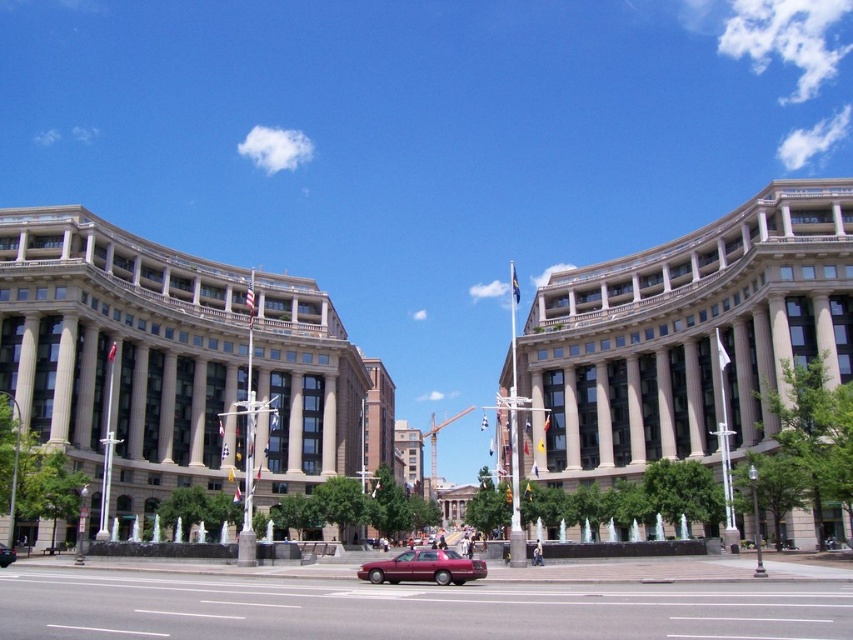
Question: Which of the following is the closest to the observer?

Choices:
 (A) shiny maroon sedan at center
 (B) metallic red car at center

Answer: (A)

Question: Which point appears farthest from the camera in this image?

Choices:
 (A) (10, 554)
 (B) (473, 572)

Answer: (A)

Question: Is shiny maroon sedan at center behind metallic red car at center?

Choices:
 (A) no
 (B) yes

Answer: (A)

Question: From the image, what is the correct spatial relationship of shiny maroon sedan at center in relation to metallic red car at center?

Choices:
 (A) left
 (B) right

Answer: (B)

Question: Is shiny maroon sedan at center positioned at the back of metallic red car at center?

Choices:
 (A) yes
 (B) no

Answer: (B)